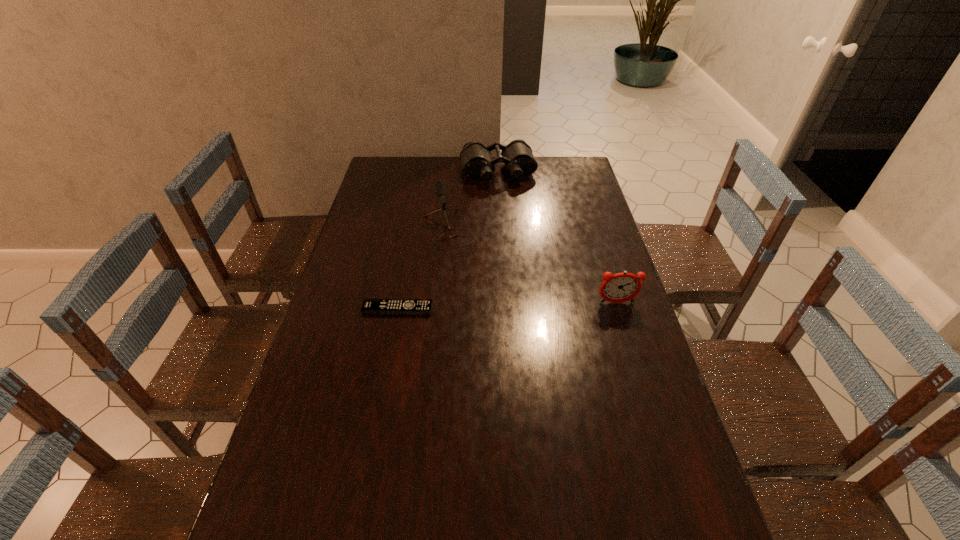
In the image, there is a desktop. Identify the location of free space at the near right corner. The width and height of the screenshot is (960, 540). (684, 497).

What are the coordinates of `free space between the third tallest object and the second farthest object` in the screenshot? It's located at (473, 200).

Where is `empty location between the rightmost object and the microphone`? The height and width of the screenshot is (540, 960). empty location between the rightmost object and the microphone is located at coordinates (533, 266).

I want to click on blank region between the third nearest object and the second shortest object, so click(473, 200).

Locate an element on the screen. The width and height of the screenshot is (960, 540). empty space between the third nearest object and the shortest object is located at coordinates (423, 269).

You are a GUI agent. You are given a task and a screenshot of the screen. Output one action in this format:
    pyautogui.click(x=<x>, y=<y>)
    Task: Click on the vacant area that lies between the third nearest object and the alarm clock
    The image size is (960, 540).
    Given the screenshot: What is the action you would take?
    pyautogui.click(x=533, y=266)

This screenshot has height=540, width=960. What are the coordinates of `free space that is in between the rightmost object and the second farthest object` in the screenshot? It's located at (533, 266).

This screenshot has height=540, width=960. I want to click on unoccupied area between the farthest object and the remote control, so click(447, 240).

The image size is (960, 540). In order to click on free spot between the microphone and the rightmost object in this screenshot , I will do [533, 266].

Locate an element on the screen. The height and width of the screenshot is (540, 960). vacant space that is in between the alarm clock and the shortest object is located at coordinates (507, 306).